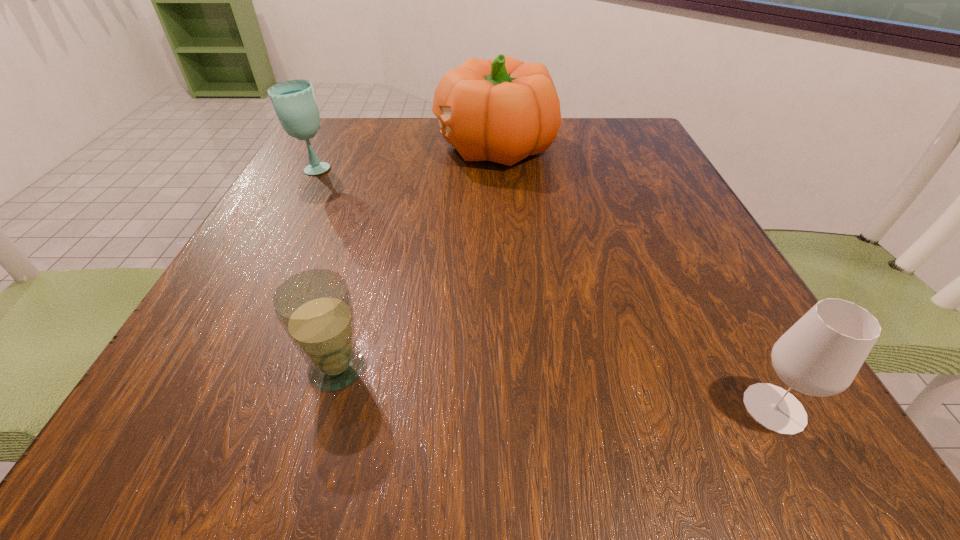
Where is `blank area located on the front of the leftmost object`? blank area located on the front of the leftmost object is located at coordinates (294, 202).

Where is `vacant space positioned 0.340m on the back of the rightmost object`? vacant space positioned 0.340m on the back of the rightmost object is located at coordinates (674, 223).

Identify the location of vacant space situated 0.090m on the left of the shortest glass. (237, 369).

Locate an element on the screen. pumpkin that is positioned at the far edge is located at coordinates (503, 110).

The width and height of the screenshot is (960, 540). What are the coordinates of `glass located at the far edge` in the screenshot? It's located at (294, 101).

You are a GUI agent. You are given a task and a screenshot of the screen. Output one action in this format:
    pyautogui.click(x=<x>, y=<y>)
    Task: Click on the object that is at the left edge
    The height and width of the screenshot is (540, 960).
    Given the screenshot: What is the action you would take?
    pyautogui.click(x=294, y=101)

This screenshot has width=960, height=540. I want to click on object present at the right edge, so click(x=820, y=355).

What are the coordinates of `object positioned at the far left corner` in the screenshot? It's located at (294, 101).

The image size is (960, 540). I want to click on object at the near right corner, so click(x=820, y=355).

In the image, there is a desktop. Where is `vacant space at the far edge`? vacant space at the far edge is located at coordinates (442, 144).